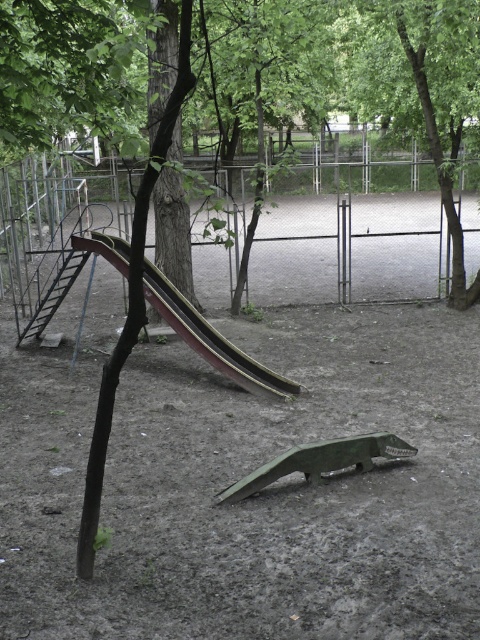
Question: Which point is closer to the camera?

Choices:
 (A) green leafy tree at center
 (B) wooden smooth slide at left

Answer: (B)

Question: Which object appears closest to the camera in this image?

Choices:
 (A) wooden smooth slide at left
 (B) green leafy tree at center

Answer: (A)

Question: Does green leafy tree at center appear on the left side of wooden smooth slide at left?

Choices:
 (A) yes
 (B) no

Answer: (B)

Question: Does green leafy tree at center have a smaller size compared to wooden smooth slide at left?

Choices:
 (A) no
 (B) yes

Answer: (A)

Question: Does green leafy tree at center appear over wooden smooth slide at left?

Choices:
 (A) no
 (B) yes

Answer: (B)